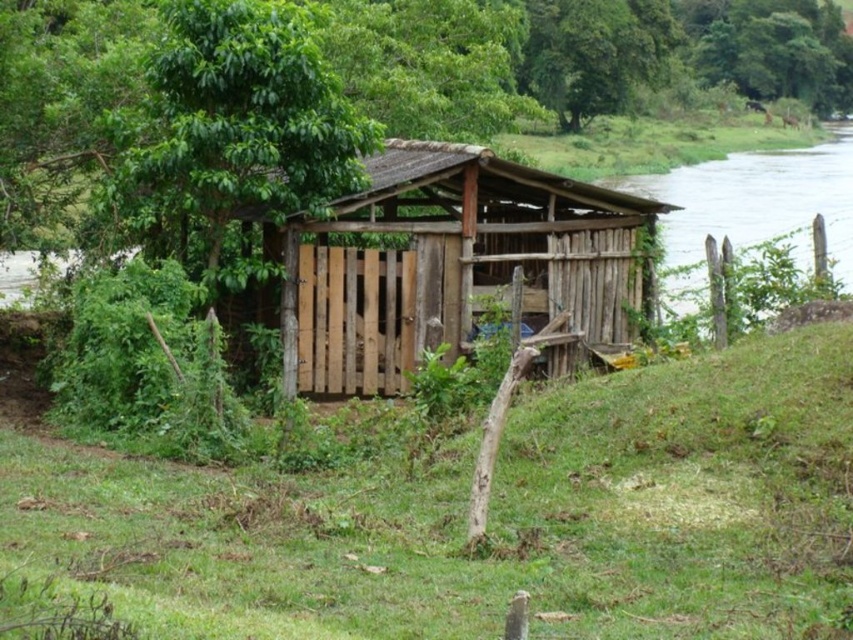
Between green grassy at center and wooden shack at center, which one appears on the right side from the viewer's perspective?

Positioned to the right is green grassy at center.

Between green grassy at center and wooden shack at center, which one has more height?

Standing taller between the two is wooden shack at center.

Is point (329, 500) in front of point (561, 186)?

Yes, point (329, 500) is in front of point (561, 186).

Identify the location of green grassy at center. This screenshot has height=640, width=853. (492, 516).

Does wooden shack at center have a smaller size compared to clear water at right?

Yes.

Who is positioned more to the right, wooden shack at center or clear water at right?

From the viewer's perspective, clear water at right appears more on the right side.

Who is more distant from viewer, (402,211) or (793,216)?

Positioned behind is point (793,216).

In order to click on wooden shack at center in this screenshot , I will do pos(453,264).

Who is more forward, (x=830, y=465) or (x=683, y=225)?

Result: Point (x=830, y=465) is in front.

Between green grassy at center and clear water at right, which one is positioned lower?

Positioned lower is green grassy at center.

You are a GUI agent. You are given a task and a screenshot of the screen. Output one action in this format:
    pyautogui.click(x=<x>, y=<y>)
    Task: Click on the green grassy at center
    This screenshot has height=640, width=853.
    Given the screenshot: What is the action you would take?
    pyautogui.click(x=492, y=516)

Where is `green grassy at center`? The height and width of the screenshot is (640, 853). green grassy at center is located at coordinates (492, 516).